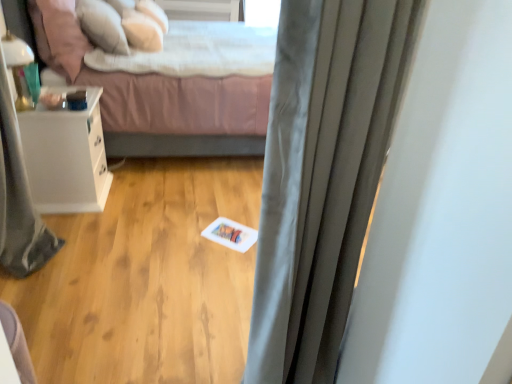
The image size is (512, 384). I want to click on free spot in front of white glossy nightstand at left, so click(x=80, y=230).